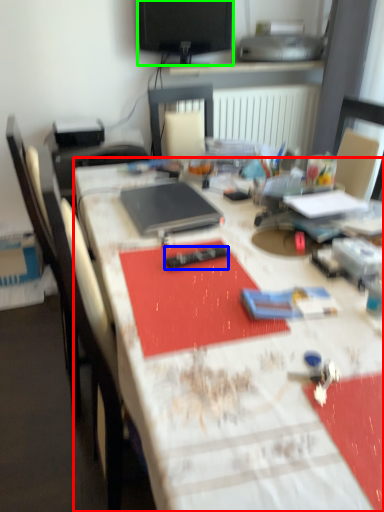
Question: Which object is the closest to the desk (highlighted by a red box)? Choose among these: remote control (highlighted by a blue box) or television (highlighted by a green box).

Choices:
 (A) remote control
 (B) television

Answer: (A)